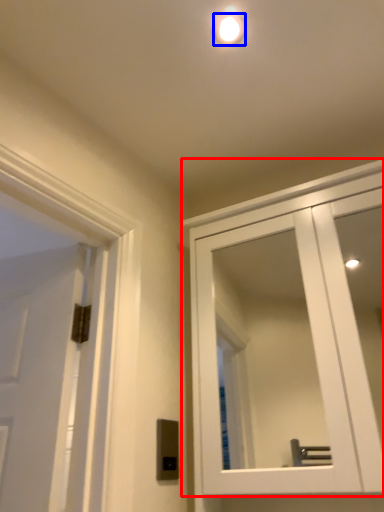
Question: Which point is closer to the camera, cabinetry (highlighted by a red box) or droplight (highlighted by a blue box)?

Choices:
 (A) cabinetry
 (B) droplight

Answer: (A)